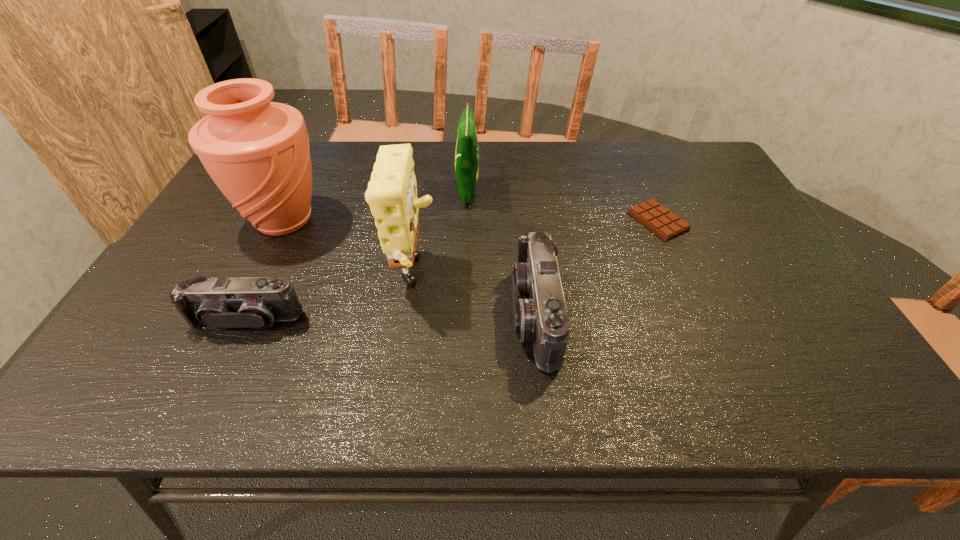
What are the coordinates of `vacant spot to place a camcorder on the right` in the screenshot? It's located at (820, 312).